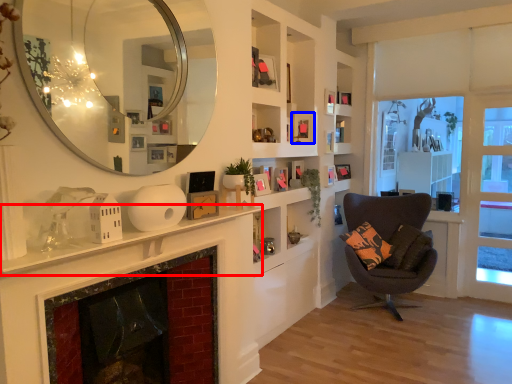
Question: Which object is closer to the camera taking this photo, mantle (highlighted by a red box) or picture frame (highlighted by a blue box)?

Choices:
 (A) mantle
 (B) picture frame

Answer: (A)